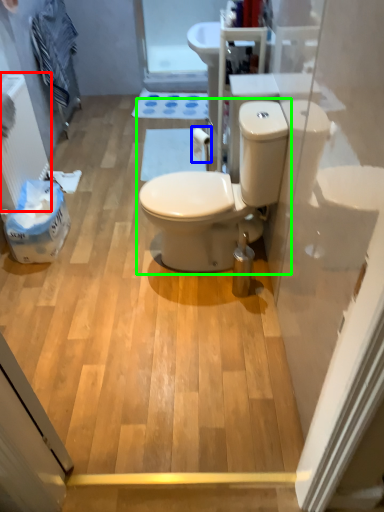
Question: Based on their relative distances, which object is farther from radiator (highlighted by a red box)? Choose from toilet paper (highlighted by a blue box) and toilet (highlighted by a green box).

Choices:
 (A) toilet paper
 (B) toilet

Answer: (B)